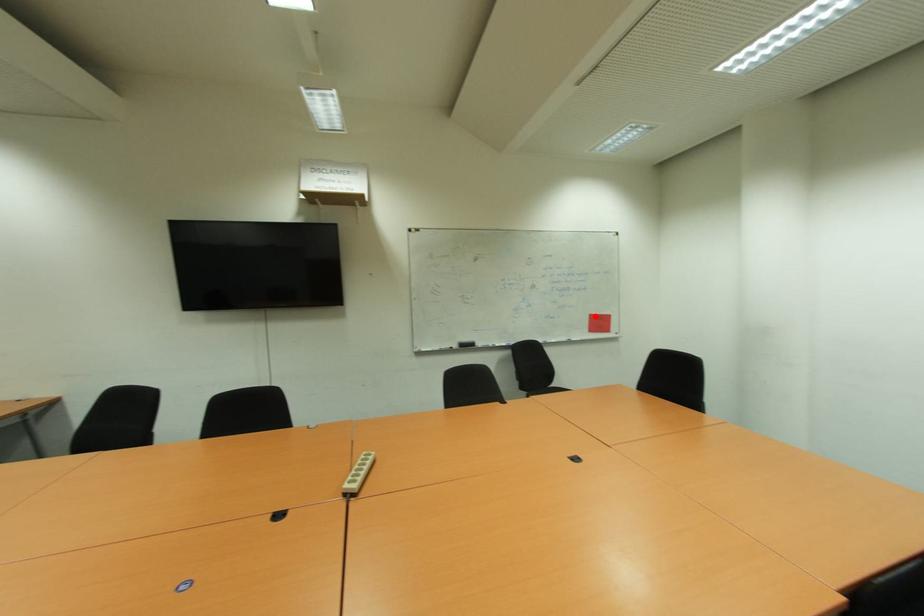
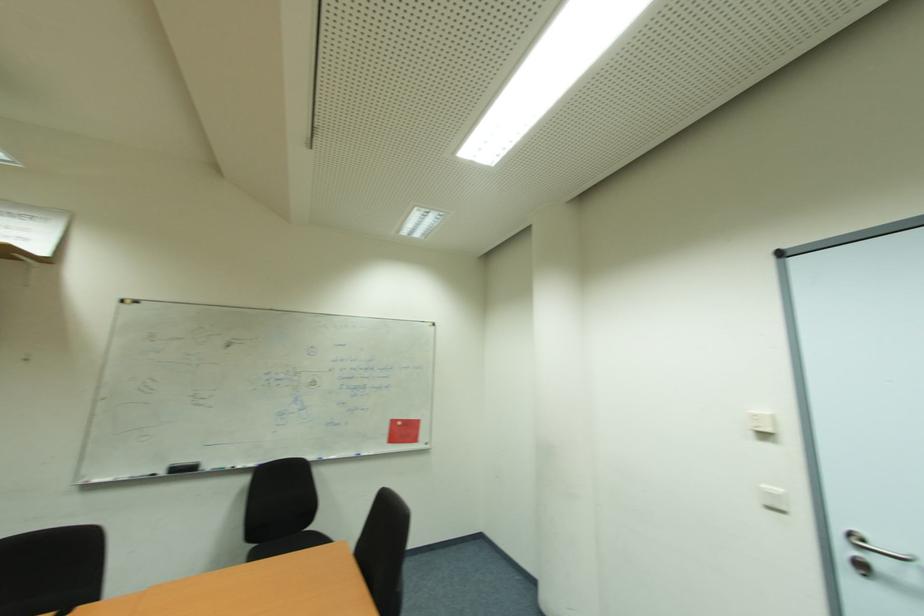
Question: A red point is marked in image1. In image2, is the corresponding 3D point closer to the camera or farther? Reply with the corresponding letter.

Choices:
 (A) The corresponding 3D point is closer.
 (B) The corresponding 3D point is farther.

Answer: (A)